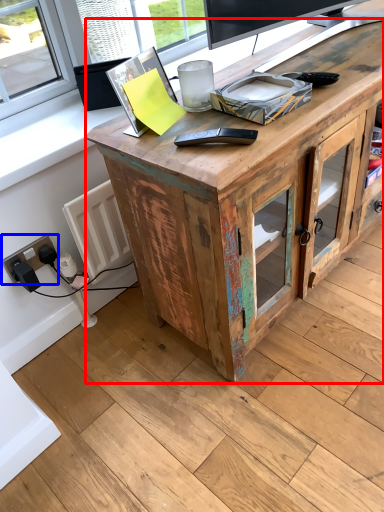
Question: Which point is closer to the camera, desk (highlighted by a red box) or electric outlet (highlighted by a blue box)?

Choices:
 (A) desk
 (B) electric outlet

Answer: (A)